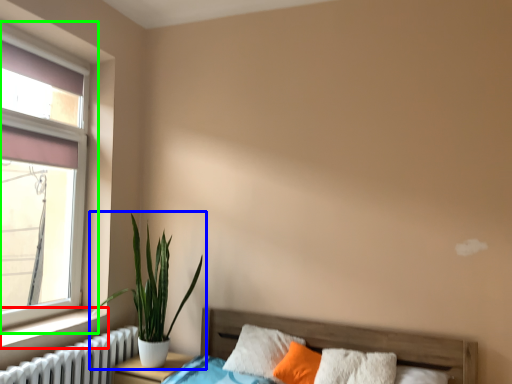
Question: Which object is the farthest from window sill (highlighted by a red box)? Choose among these: houseplant (highlighted by a blue box) or window (highlighted by a green box).

Choices:
 (A) houseplant
 (B) window

Answer: (B)